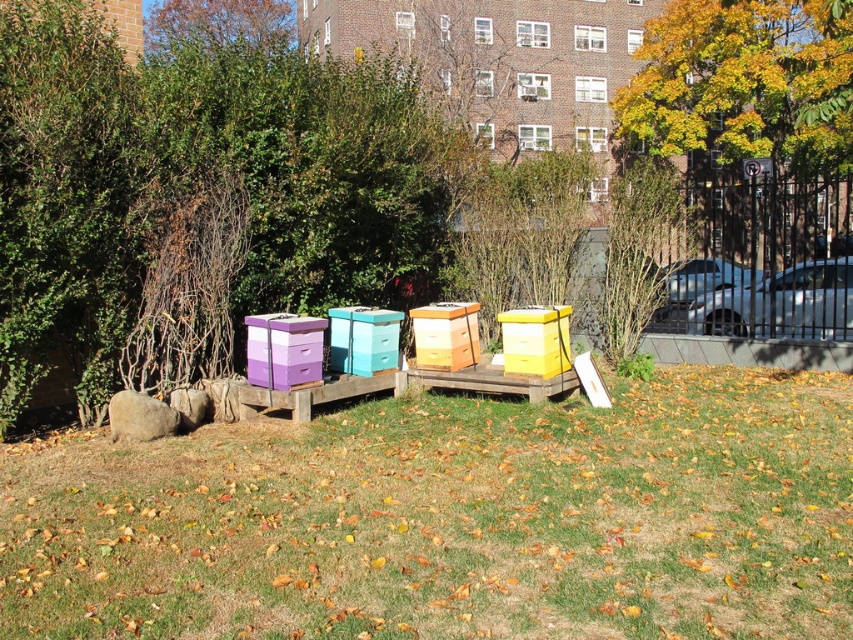
Question: Which point is closer to the camera taking this photo?

Choices:
 (A) (352, 362)
 (B) (567, 307)
 (C) (456, 330)
 (D) (767, 81)

Answer: (C)

Question: Does green grass at center have a smaller size compared to teal plastic crate at center?

Choices:
 (A) no
 (B) yes

Answer: (B)

Question: Does yellow/golden leaves at upper right have a greater width compared to yellow matte beehive at center?

Choices:
 (A) yes
 (B) no

Answer: (A)

Question: Is purple matte beehive at center to the left of teal plastic crate at center from the viewer's perspective?

Choices:
 (A) no
 (B) yes

Answer: (B)

Question: Which of the following is the farthest from the observer?

Choices:
 (A) (428, 337)
 (B) (283, 340)

Answer: (A)

Question: Which object appears closest to the camera in this image?

Choices:
 (A) teal plastic crate at center
 (B) yellow/golden leaves at upper right
 (C) green grass at center
 (D) wooden beehive at center

Answer: (C)